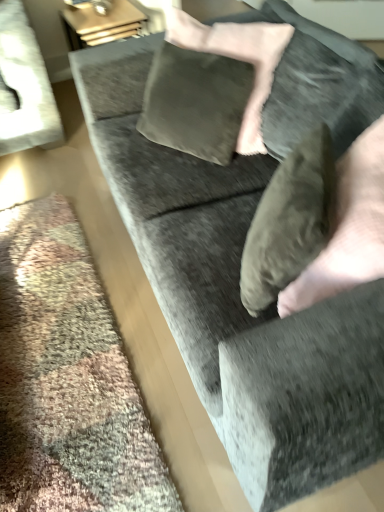
Question: Considering the relative positions of velvet gray pillow at center and suede-like tan hand at lower right in the image provided, is velvet gray pillow at center to the left or to the right of suede-like tan hand at lower right?

Choices:
 (A) left
 (B) right

Answer: (A)

Question: Which is correct: velvet gray pillow at center is inside suede-like tan hand at lower right, or outside of it?

Choices:
 (A) outside
 (B) inside

Answer: (B)

Question: Considering the positions of point (271, 226) and point (314, 267), is point (271, 226) closer or farther from the camera than point (314, 267)?

Choices:
 (A) farther
 (B) closer

Answer: (B)

Question: Is suede-like tan hand at lower right bigger or smaller than velvet gray pillow at center?

Choices:
 (A) small
 (B) big

Answer: (B)

Question: Considering the positions of suede-like tan hand at lower right and velvet gray pillow at center in the image, is suede-like tan hand at lower right wider or thinner than velvet gray pillow at center?

Choices:
 (A) wide
 (B) thin

Answer: (A)

Question: Visually, is suede-like tan hand at lower right positioned to the left or to the right of velvet gray pillow at center?

Choices:
 (A) right
 (B) left

Answer: (A)

Question: From a real-world perspective, is suede-like tan hand at lower right positioned above or below velvet gray pillow at center?

Choices:
 (A) above
 (B) below

Answer: (B)